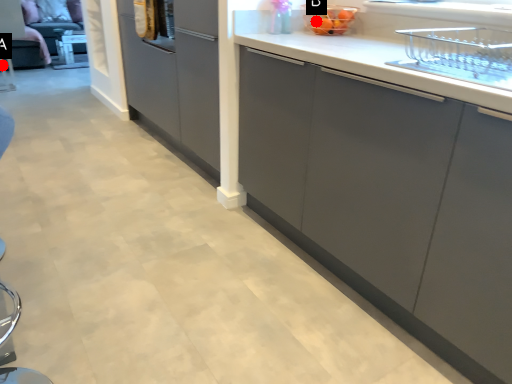
Question: Two points are circled on the image, labeled by A and B beside each circle. Which point is farther from the camera taking this photo?

Choices:
 (A) A is further
 (B) B is further

Answer: (A)